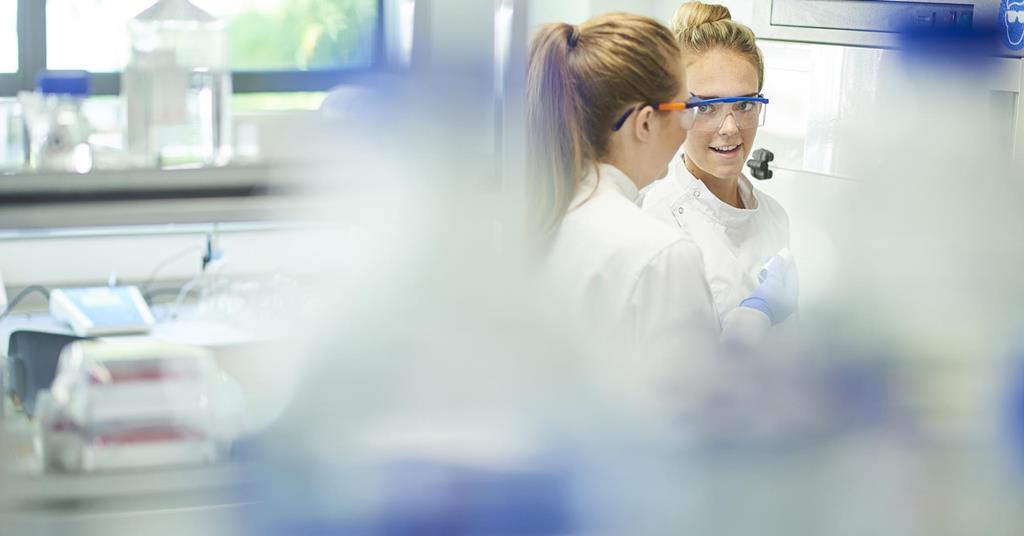
Find the location of `jug`. jug is located at coordinates (220, 42).